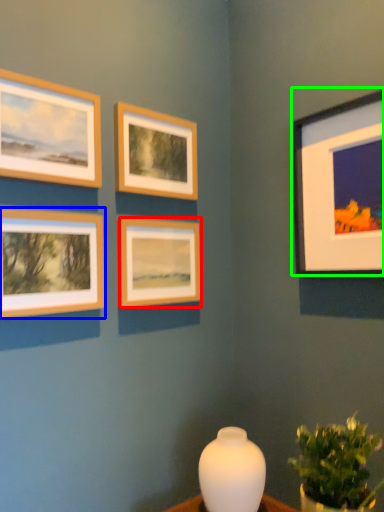
Question: Which is nearer to the picture frame (highlighted by a red box)? picture frame (highlighted by a blue box) or picture frame (highlighted by a green box).

Choices:
 (A) picture frame
 (B) picture frame

Answer: (A)